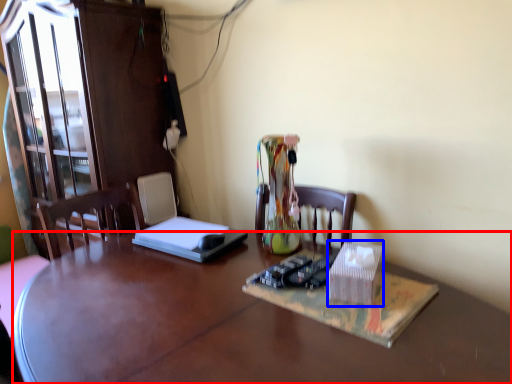
Question: Among these objects, which one is farthest to the camera, desk (highlighted by a red box) or cardboard box (highlighted by a blue box)?

Choices:
 (A) desk
 (B) cardboard box

Answer: (B)